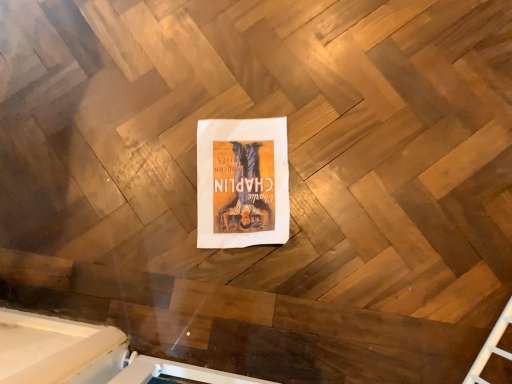
Find the location of `vacant area that lies to the right of white paper poster at center`. vacant area that lies to the right of white paper poster at center is located at coordinates (337, 163).